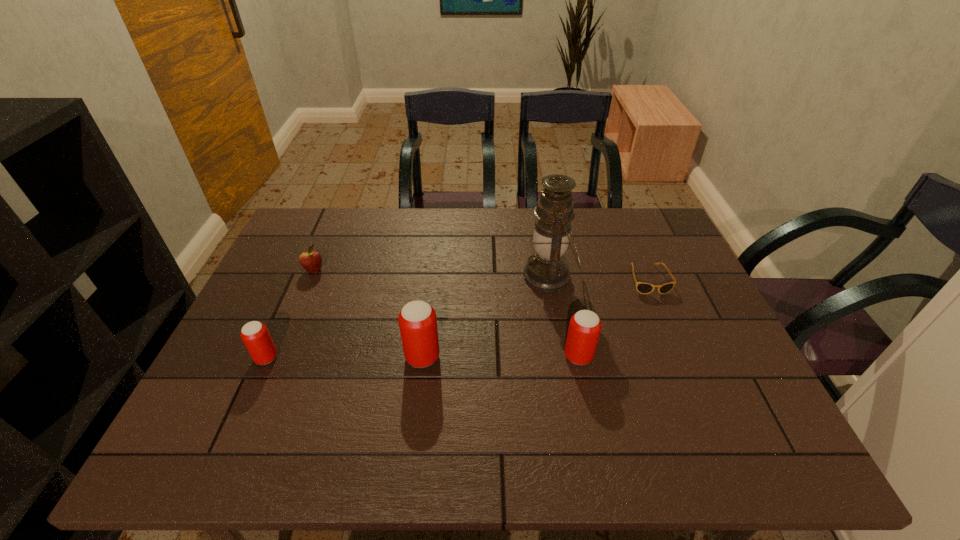
What are the coordinates of `blank area located on the back of the leftmost beer can` in the screenshot? It's located at (277, 333).

At what (x,y) coordinates should I click in order to perform the action: click on free region located 0.350m on the right of the fifth shortest object. Please return your answer as a coordinate pair (x, y). The image size is (960, 540). Looking at the image, I should click on (583, 357).

Image resolution: width=960 pixels, height=540 pixels. I want to click on vacant region located 0.130m on the left of the third tallest object, so click(511, 356).

At what (x,y) coordinates should I click in order to perform the action: click on vacant space located on the front-facing side of the sunglasses. Please return your answer as a coordinate pair (x, y). This screenshot has width=960, height=540. Looking at the image, I should click on (669, 330).

At what (x,y) coordinates should I click in order to perform the action: click on free region located on the right of the fifth tallest object. Please return your answer as a coordinate pair (x, y). Looking at the image, I should click on (355, 271).

You are a GUI agent. You are given a task and a screenshot of the screen. Output one action in this format:
    pyautogui.click(x=<x>, y=<y>)
    Task: Click on the vacant space located on the right of the oil lamp
    The width and height of the screenshot is (960, 540).
    Given the screenshot: What is the action you would take?
    pyautogui.click(x=623, y=276)

Find the location of a particular element. beer can located at the left edge is located at coordinates (254, 334).

At what (x,y) coordinates should I click in order to perform the action: click on apple present at the left edge. Please return your answer as a coordinate pair (x, y). The width and height of the screenshot is (960, 540). Looking at the image, I should click on [311, 261].

Where is `object located in the right edge section of the desktop`? The width and height of the screenshot is (960, 540). object located in the right edge section of the desktop is located at coordinates (644, 288).

The image size is (960, 540). In order to click on free space at the far edge of the desktop in this screenshot , I will do `click(454, 224)`.